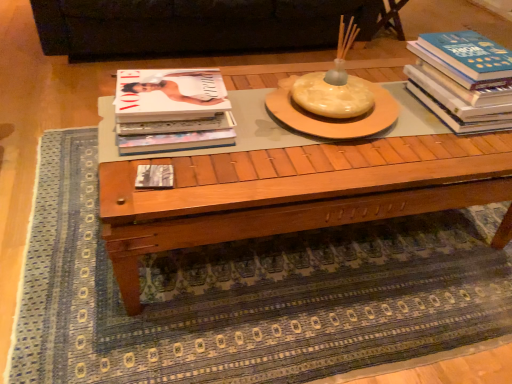
Question: Looking at the image, does wooden coffee table at center seem bigger or smaller compared to matte white magazine at left, which appears as the 2th book when viewed from the right?

Choices:
 (A) small
 (B) big

Answer: (B)

Question: From a real-world perspective, is wooden coffee table at center above or below matte white magazine at left, which appears as the 2th book when viewed from the right?

Choices:
 (A) below
 (B) above

Answer: (A)

Question: Based on their relative distances, which object is farther from the wooden coffee table at center?

Choices:
 (A) matte black book at center, marked as the third book in a right-to-left arrangement
 (B) matte white magazine at left, which is the 2th book in left-to-right order
 (C) blue hardcover book at right, which ranks as the third book in left-to-right order
 (D) black leather couch at upper center

Answer: (D)

Question: Which object is positioned closest to the blue hardcover book at right, which ranks as the third book in left-to-right order?

Choices:
 (A) wooden coffee table at center
 (B) black leather couch at upper center
 (C) matte white magazine at left, which is the 2th book in left-to-right order
 (D) matte black book at center, marked as the third book in a right-to-left arrangement

Answer: (A)